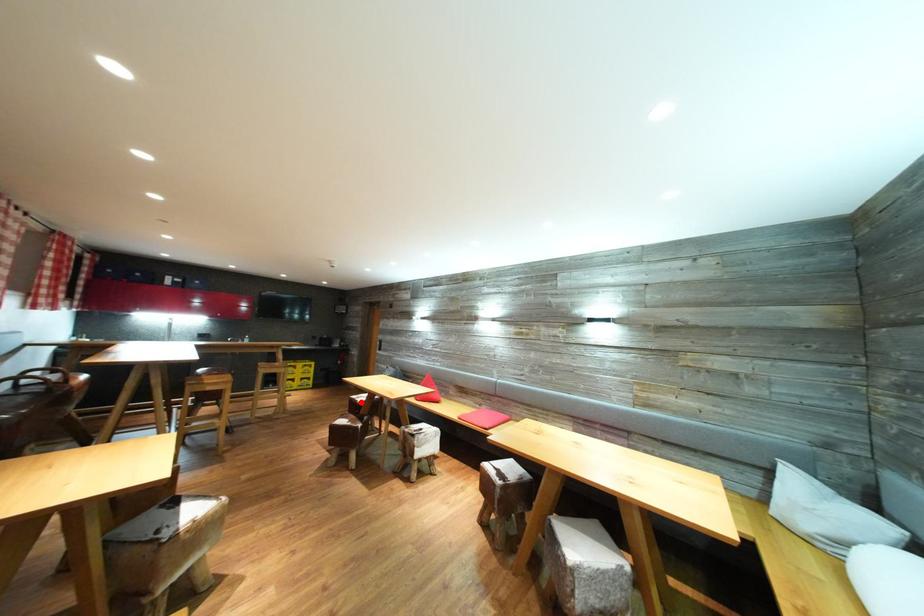
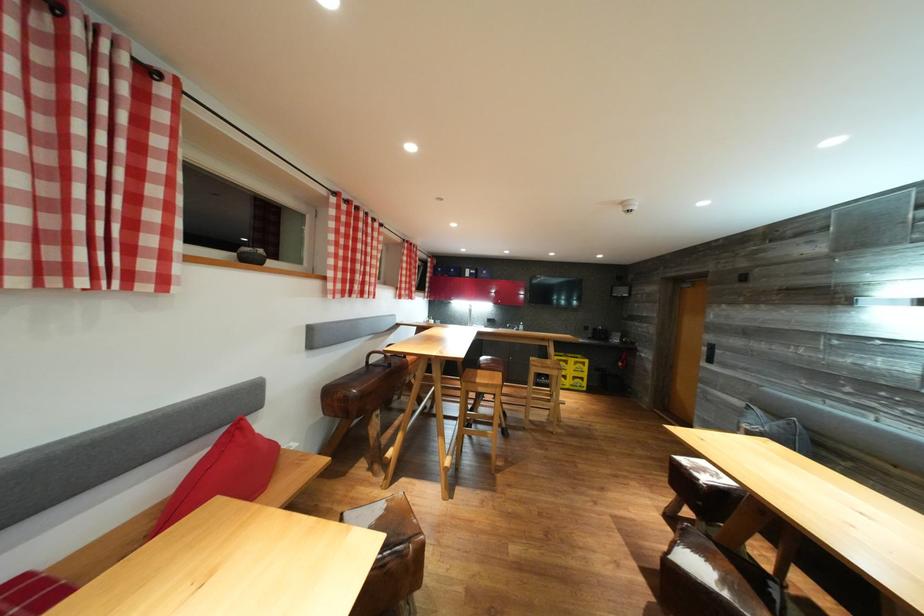
Question: I am providing you with two images of the same scene from different viewpoints. In image1, a red point is highlighted. Considering the same 3D point in image2, which of the following is correct?

Choices:
 (A) It is closer
 (B) It is farther

Answer: (A)